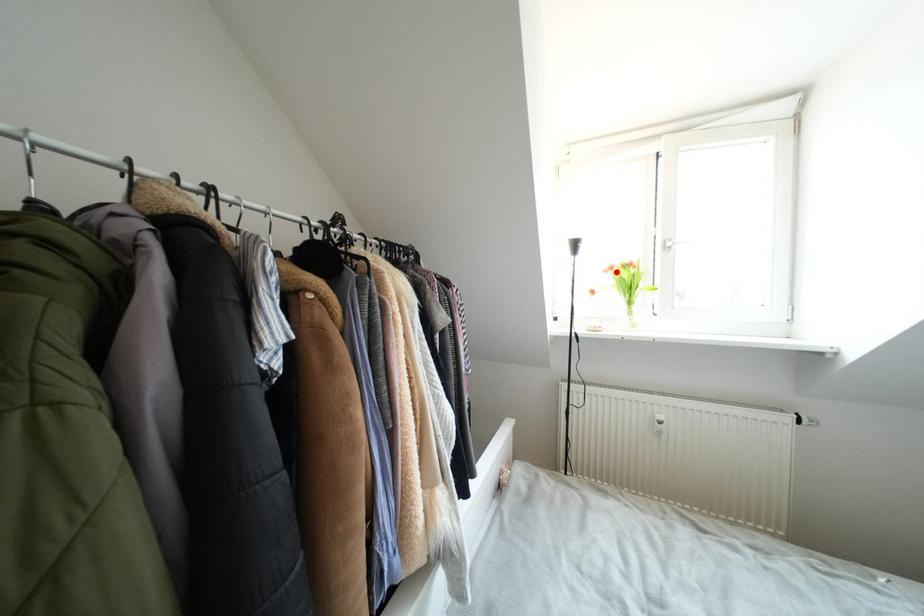
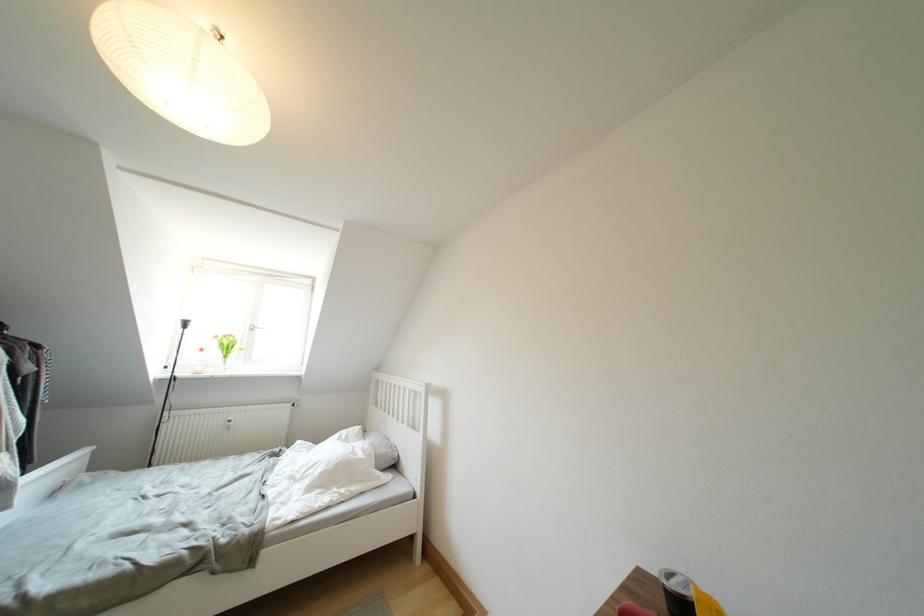
Question: I am providing you with two images of the same scene from different viewpoints. A red point is shown in image1. For the corresponding object point in image2, is it positioned nearer or farther from the camera?

Choices:
 (A) Nearer
 (B) Farther

Answer: (B)